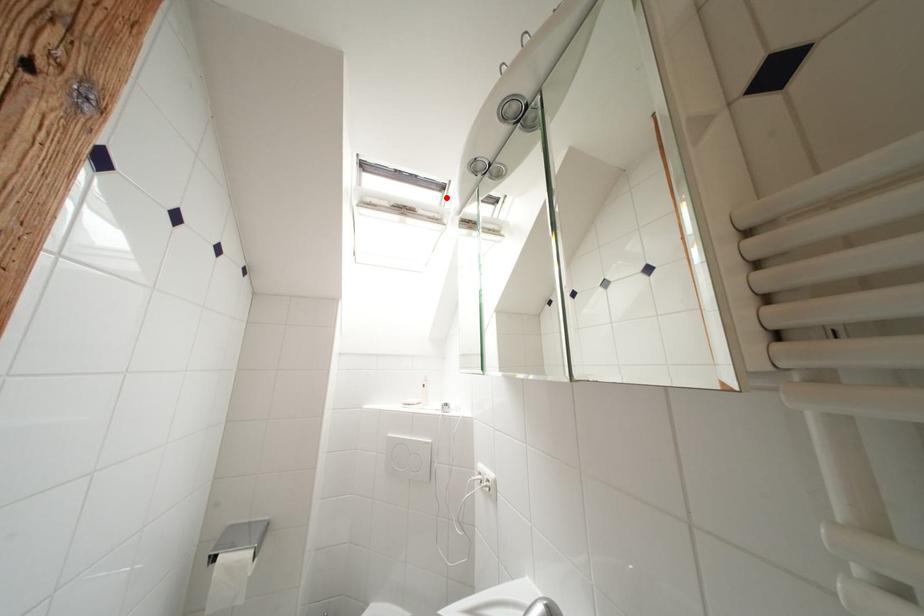
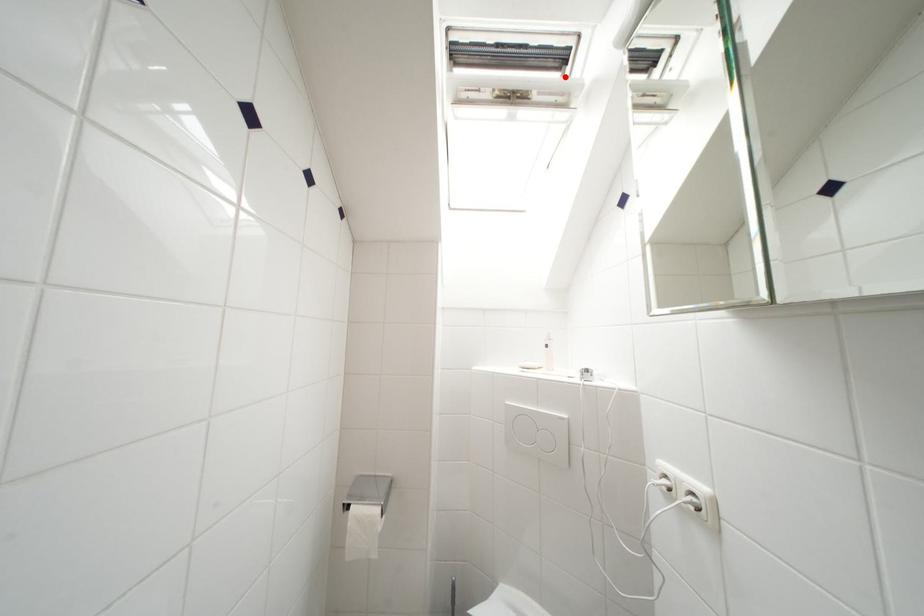
I am providing you with two images of the same scene from different viewpoints. A red point is marked on the first image and another point is marked on the second image. Is the marked point in image1 the same physical position as the marked point in image2?

Yes